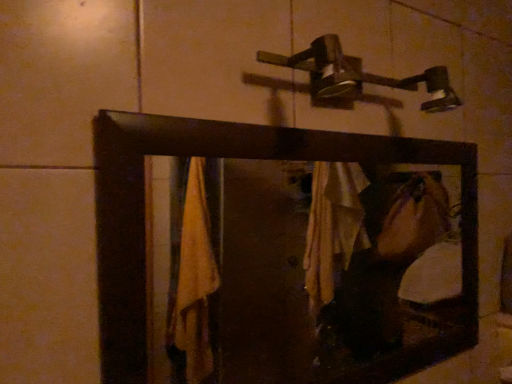
Question: In terms of width, does wooden frame mirror at center look wider or thinner when compared to metallic silver shower at upper center?

Choices:
 (A) thin
 (B) wide

Answer: (A)

Question: From a real-world perspective, is wooden frame mirror at center above or below metallic silver shower at upper center?

Choices:
 (A) above
 (B) below

Answer: (B)

Question: From the image's perspective, relative to metallic silver shower at upper center, is wooden frame mirror at center above or below?

Choices:
 (A) below
 (B) above

Answer: (A)

Question: From a real-world perspective, is metallic silver shower at upper center positioned above or below wooden frame mirror at center?

Choices:
 (A) above
 (B) below

Answer: (A)

Question: Is metallic silver shower at upper center situated inside wooden frame mirror at center or outside?

Choices:
 (A) outside
 (B) inside

Answer: (A)

Question: In the image, is metallic silver shower at upper center positioned in front of or behind wooden frame mirror at center?

Choices:
 (A) behind
 (B) front

Answer: (A)

Question: In terms of size, does metallic silver shower at upper center appear bigger or smaller than wooden frame mirror at center?

Choices:
 (A) big
 (B) small

Answer: (B)